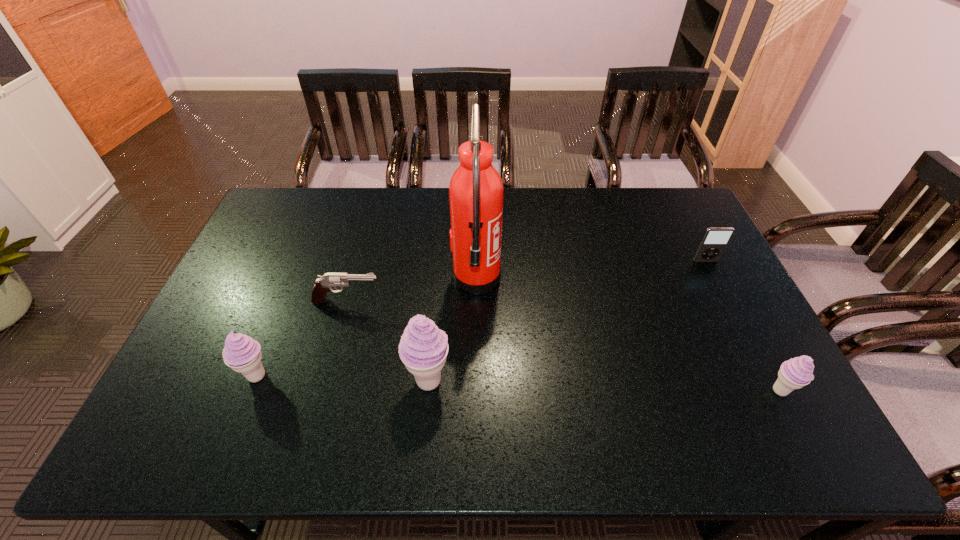
Find the location of `free region located on the back of the shortest icecream`. free region located on the back of the shortest icecream is located at coordinates (763, 359).

Where is `free location located on the front-facing side of the iPod`? This screenshot has height=540, width=960. free location located on the front-facing side of the iPod is located at coordinates (726, 300).

Locate an element on the screen. This screenshot has width=960, height=540. free spot located 0.090m at the muzzle of the gun is located at coordinates (412, 301).

At what (x,y) coordinates should I click in order to perform the action: click on vacant area located on the label side of the tallest object. Please return your answer as a coordinate pair (x, y). The width and height of the screenshot is (960, 540). Looking at the image, I should click on (537, 279).

This screenshot has height=540, width=960. I want to click on object located in the left edge section of the desktop, so click(x=241, y=353).

This screenshot has height=540, width=960. I want to click on icecream located in the right edge section of the desktop, so click(795, 373).

The height and width of the screenshot is (540, 960). I want to click on iPod that is at the right edge, so click(x=715, y=240).

Identify the location of object that is at the near left corner. The height and width of the screenshot is (540, 960). (241, 353).

Find the location of a particular element. object located at the near right corner is located at coordinates (795, 373).

The image size is (960, 540). In the image, there is a desktop. In order to click on vacant space at the far edge in this screenshot , I will do `click(448, 224)`.